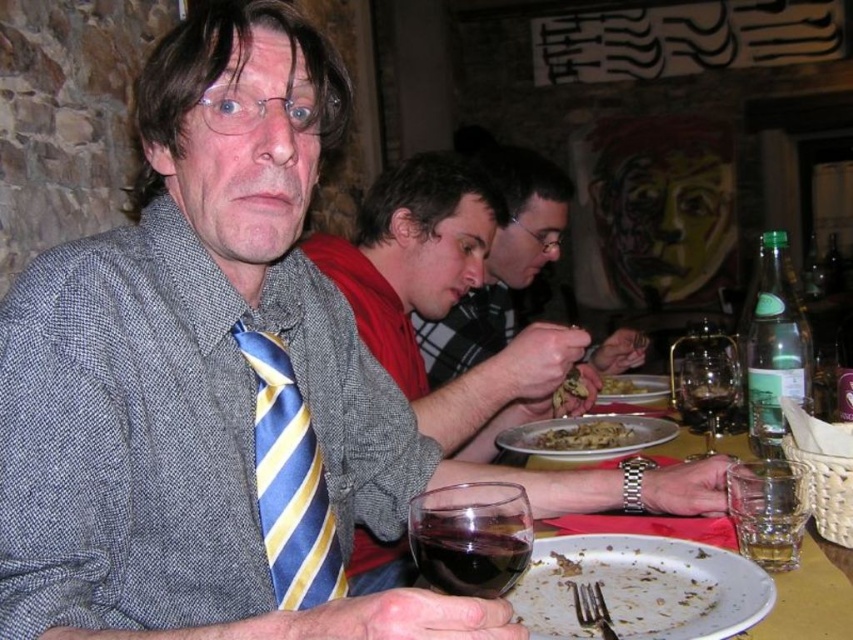
Question: Which point is farther to the camera?

Choices:
 (A) (521, 525)
 (B) (331, 564)
 (C) (532, 445)

Answer: (C)

Question: Observing the image, what is the correct spatial positioning of white porcelain plate at center in reference to yellowish matte pasta at center?

Choices:
 (A) above
 (B) below

Answer: (B)

Question: Which object is the farthest from the golden brown pasta at center?

Choices:
 (A) yellowish matte pasta at center
 (B) white matte plate at center
 (C) white porcelain plate at center
 (D) brown crumbly bread at center

Answer: (C)

Question: Can you confirm if white porcelain plate at center is smaller than dark red glass at center?

Choices:
 (A) no
 (B) yes

Answer: (A)

Question: Which point appears closest to the camera in this image?

Choices:
 (A) (633, 390)
 (B) (283, 440)
 (C) (503, 572)

Answer: (C)

Question: Is transparent glass wine glass at center closer to camera compared to golden brown pasta at center?

Choices:
 (A) yes
 (B) no

Answer: (A)